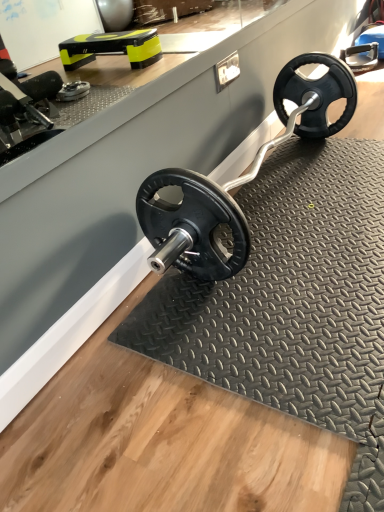
Where is `vacant space situated above black rubber mat at center (from a real-world perspective)`? The image size is (384, 512). vacant space situated above black rubber mat at center (from a real-world perspective) is located at coordinates (286, 247).